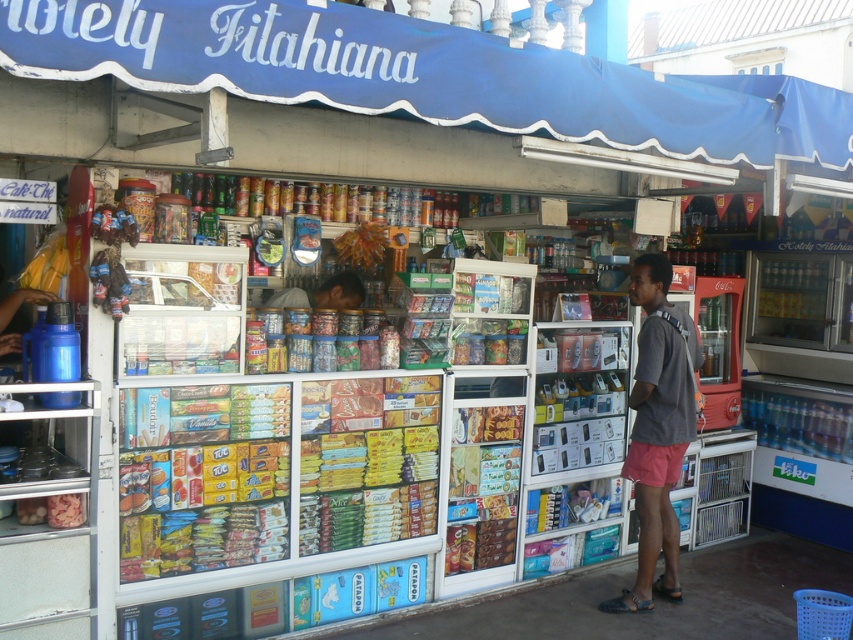
Is gray fabric shirt at center bigger than matte brown bag at center?

Indeed, gray fabric shirt at center has a larger size compared to matte brown bag at center.

Who is positioned more to the right, gray fabric shirt at center or matte brown bag at center?

gray fabric shirt at center

You are a GUI agent. You are given a task and a screenshot of the screen. Output one action in this format:
    pyautogui.click(x=<x>, y=<y>)
    Task: Click on the gray fabric shirt at center
    This screenshot has width=853, height=640.
    Given the screenshot: What is the action you would take?
    pyautogui.click(x=657, y=429)

The height and width of the screenshot is (640, 853). I want to click on gray fabric shirt at center, so click(657, 429).